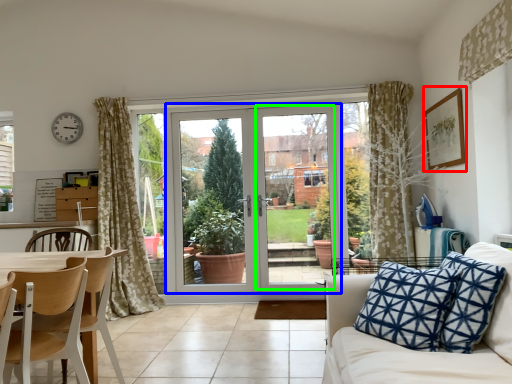
Question: Which is nearer to the picture frame (highlighted by a red box)? door (highlighted by a blue box) or screen door (highlighted by a green box).

Choices:
 (A) door
 (B) screen door

Answer: (B)